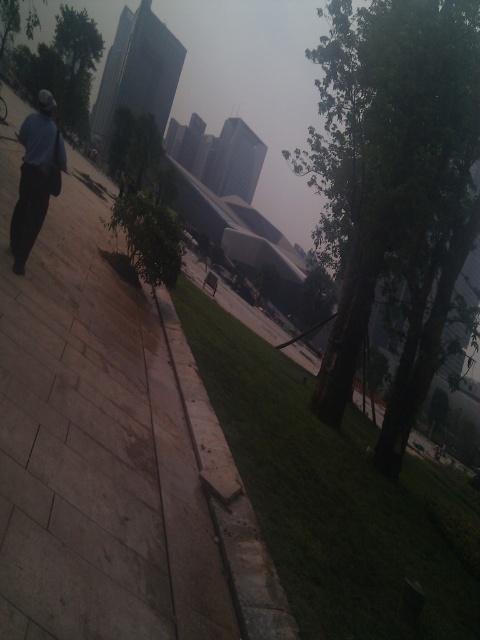
Can you confirm if gray concrete curb at center is thinner than green leafy tree at upper left?

Correct, gray concrete curb at center's width is less than green leafy tree at upper left's.

Is gray concrete curb at center further to the viewer compared to green leafy tree at upper left?

No, it is not.

The height and width of the screenshot is (640, 480). Describe the element at coordinates (227, 497) in the screenshot. I see `gray concrete curb at center` at that location.

You are a GUI agent. You are given a task and a screenshot of the screen. Output one action in this format:
    pyautogui.click(x=<x>, y=<y>)
    Task: Click on the gray concrete curb at center
    This screenshot has width=480, height=640.
    Given the screenshot: What is the action you would take?
    pyautogui.click(x=227, y=497)

Does light brown stone pavement at center lie in front of green leafy tree at upper left?

Yes, light brown stone pavement at center is in front of green leafy tree at upper left.

Who is more forward, (47, 394) or (76, 116)?

Point (47, 394) is in front.

Who is more distant from viewer, (115,504) or (41,68)?

The point (41,68) is more distant.

You are a GUI agent. You are given a task and a screenshot of the screen. Output one action in this format:
    pyautogui.click(x=<x>, y=<y>)
    Task: Click on the light brown stone pavement at center
    This screenshot has height=640, width=480.
    Given the screenshot: What is the action you would take?
    pyautogui.click(x=95, y=445)

Does light brown stone pavement at center have a smaller size compared to green leafy tree at center?

Yes.

This screenshot has height=640, width=480. Describe the element at coordinates (95, 445) in the screenshot. I see `light brown stone pavement at center` at that location.

Find the location of a particular element. The height and width of the screenshot is (640, 480). light brown stone pavement at center is located at coordinates (x=95, y=445).